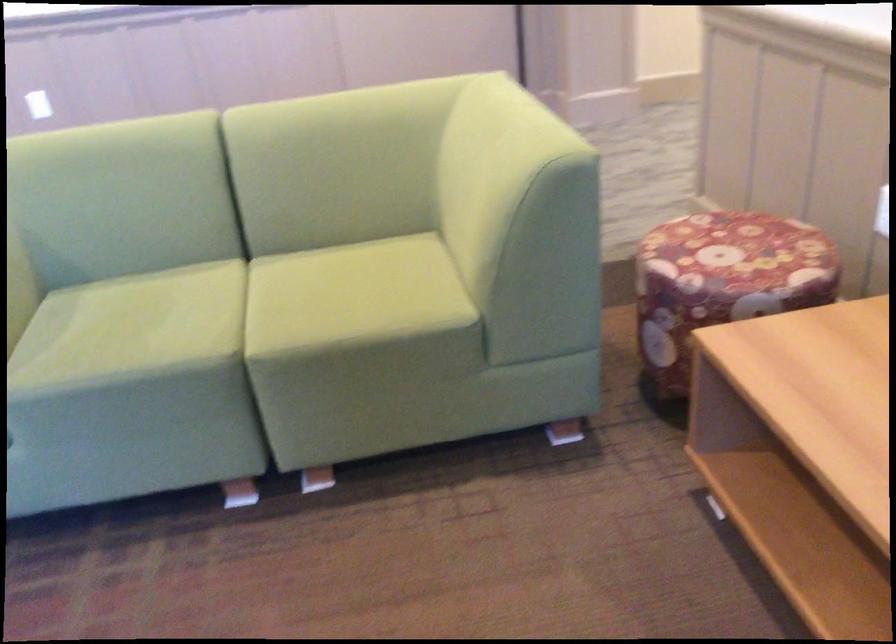
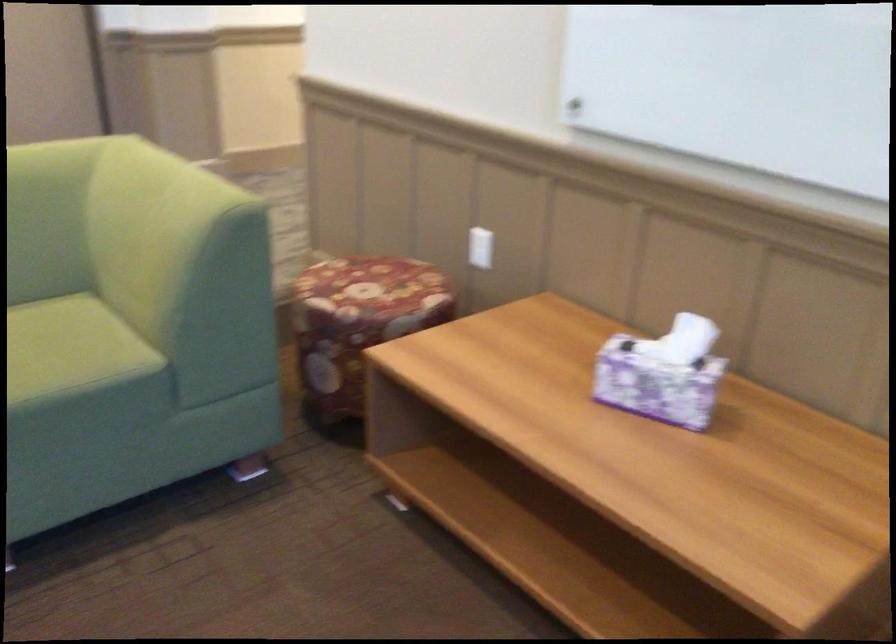
In the second image, find the point that corresponds to pixel 381 274 in the first image.

(46, 339)